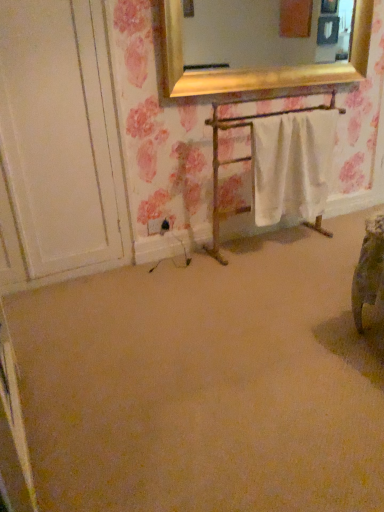
Question: From a real-world perspective, is white fabric towel rack at center located beneath black plastic electric outlet at lower left?

Choices:
 (A) no
 (B) yes

Answer: (A)

Question: Is white fabric towel rack at center in contact with black plastic electric outlet at lower left?

Choices:
 (A) no
 (B) yes

Answer: (A)

Question: Is the position of white fabric towel rack at center more distant than that of black plastic electric outlet at lower left?

Choices:
 (A) yes
 (B) no

Answer: (B)

Question: Is white fabric towel rack at center at the left side of black plastic electric outlet at lower left?

Choices:
 (A) yes
 (B) no

Answer: (B)

Question: Is black plastic electric outlet at lower left completely or partially inside white fabric towel rack at center?

Choices:
 (A) yes
 (B) no

Answer: (B)

Question: From a real-world perspective, is white cotton towel at center positioned above or below black plastic electric outlet at lower left?

Choices:
 (A) above
 (B) below

Answer: (A)

Question: From the image's perspective, is white cotton towel at center positioned above or below black plastic electric outlet at lower left?

Choices:
 (A) above
 (B) below

Answer: (A)

Question: Visually, is white cotton towel at center positioned to the left or to the right of black plastic electric outlet at lower left?

Choices:
 (A) left
 (B) right

Answer: (B)

Question: Which is correct: white cotton towel at center is inside black plastic electric outlet at lower left, or outside of it?

Choices:
 (A) outside
 (B) inside

Answer: (A)

Question: Would you say white fabric towel rack at center is inside or outside black plastic electric outlet at lower left?

Choices:
 (A) inside
 (B) outside

Answer: (B)

Question: In terms of size, does white fabric towel rack at center appear bigger or smaller than black plastic electric outlet at lower left?

Choices:
 (A) big
 (B) small

Answer: (A)

Question: Is white fabric towel rack at center wider or thinner than black plastic electric outlet at lower left?

Choices:
 (A) thin
 (B) wide

Answer: (B)

Question: From a real-world perspective, is white fabric towel rack at center positioned above or below black plastic electric outlet at lower left?

Choices:
 (A) above
 (B) below

Answer: (A)

Question: In terms of width, does beige carpet at center look wider or thinner when compared to black plastic electric outlet at lower left?

Choices:
 (A) thin
 (B) wide

Answer: (B)

Question: Does point (112, 431) appear closer or farther from the camera than point (147, 228)?

Choices:
 (A) farther
 (B) closer

Answer: (B)